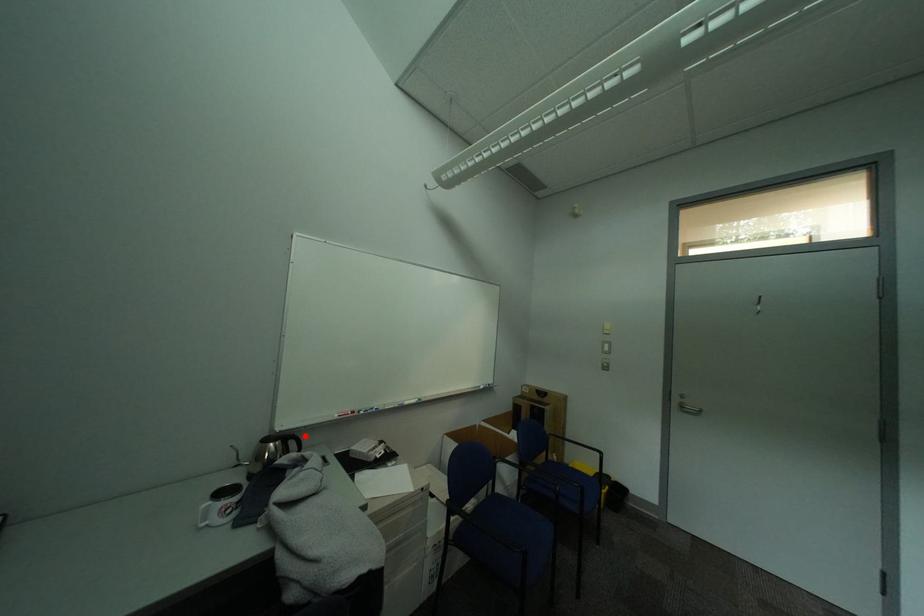
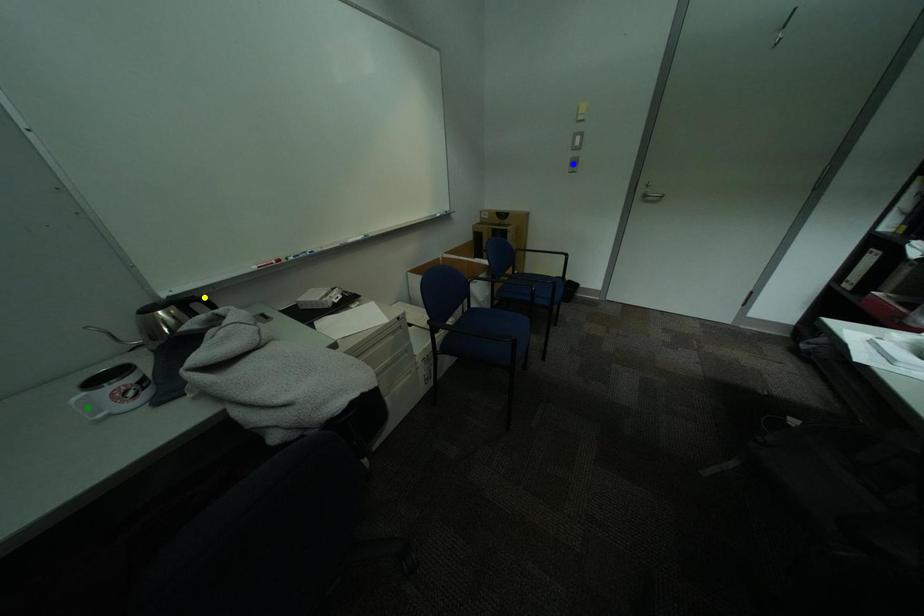
Question: I am providing you with two images of the same scene from different viewpoints. A red point is marked on the first image. You are given multiple points on the second image. Which point in image 2 is actually the same real-world point as the red point in image 1?

Choices:
 (A) blue point
 (B) green point
 (C) yellow point

Answer: (C)